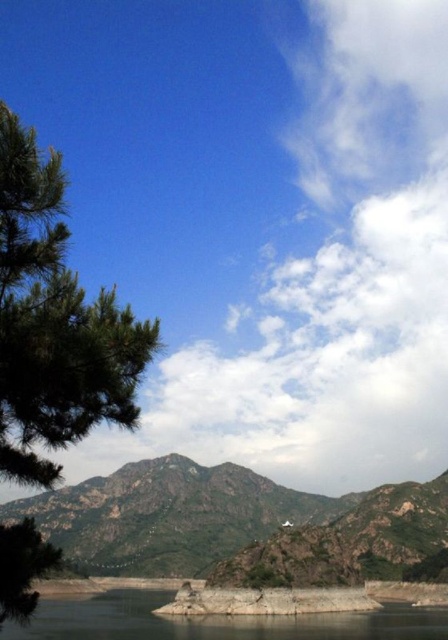
Based on the photo, is rugged stone mountain at center bigger than clear water at lower left?

Yes.

Is rugged stone mountain at center smaller than clear water at lower left?

Incorrect, rugged stone mountain at center is not smaller in size than clear water at lower left.

Which is behind, point (206, 532) or point (112, 589)?

Point (206, 532)

You are a GUI agent. You are given a task and a screenshot of the screen. Output one action in this format:
    pyautogui.click(x=<x>, y=<y>)
    Task: Click on the rugged stone mountain at center
    The height and width of the screenshot is (640, 448).
    Given the screenshot: What is the action you would take?
    pyautogui.click(x=224, y=516)

Does point (76, 300) lie behind point (296, 630)?

No, (76, 300) is closer to viewer.

Does point (69, 289) come in front of point (99, 621)?

Yes, it is in front of point (99, 621).

Which is in front, point (38, 248) or point (0, 632)?

Point (38, 248) is in front.

The width and height of the screenshot is (448, 640). Find the location of `green matte tree at left`. green matte tree at left is located at coordinates (54, 321).

Does green matte tree at left have a lesser width compared to rugged stone mountain at center?

Yes, green matte tree at left is thinner than rugged stone mountain at center.

Is point (12, 312) positioned behind point (330, 515)?

No, it is in front of (330, 515).

What are the coordinates of `green matte tree at left` in the screenshot? It's located at (54, 321).